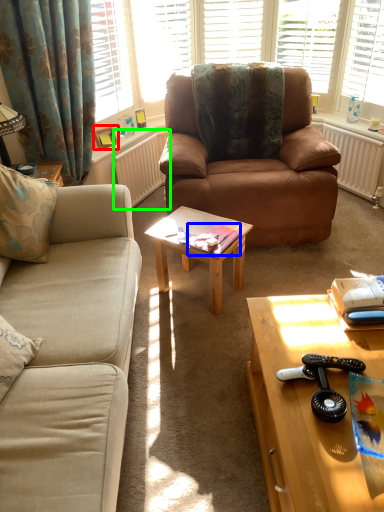
Question: Which object is positioned closest to picture frame (highlighted by a red box)? Select from book (highlighted by a blue box) and radiator (highlighted by a green box).

Choices:
 (A) book
 (B) radiator

Answer: (B)